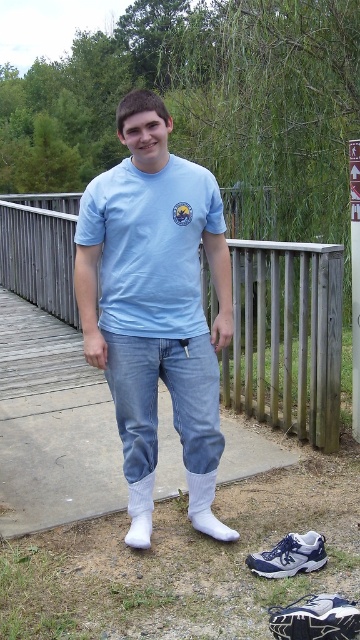
You are standing on a wooden deck and want to hand a small item to someone who is at the blue denim jeans at center. Considering the distance, can you comfortably reach them without moving closer?

The blue denim jeans at center is 4.35 meters away from the viewer. Since the average comfortable reaching distance for handing an item is typically around 1.5 to 2 meters, you would need to move closer to comfortably hand the item.